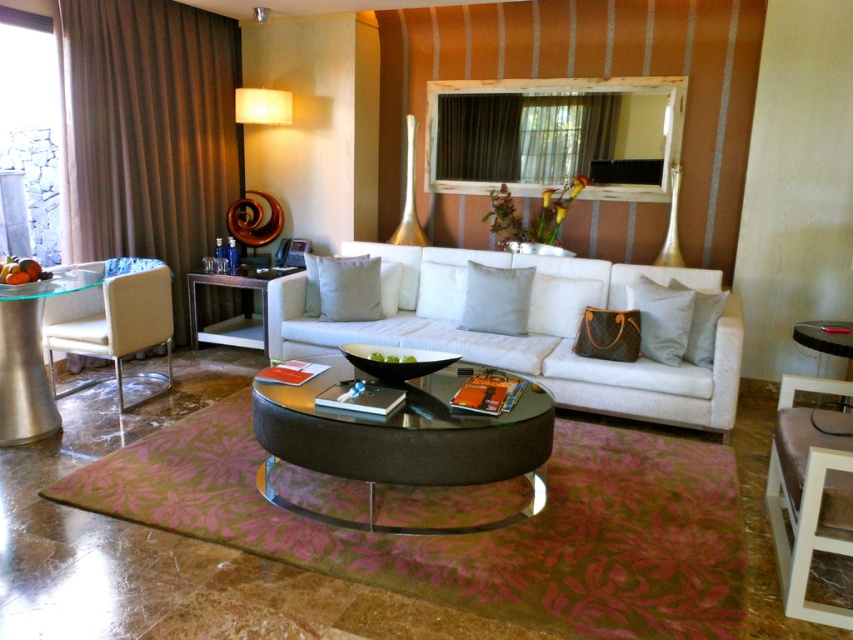
Between brown fabric curtain at left and white wood armchair at lower right, which one has more height?

With more height is brown fabric curtain at left.

In the scene shown: Which of these two, brown fabric curtain at left or white wood armchair at lower right, stands shorter?

With less height is white wood armchair at lower right.

The image size is (853, 640). I want to click on brown fabric curtain at left, so click(x=148, y=132).

Image resolution: width=853 pixels, height=640 pixels. Find the location of `brown fabric curtain at left`. brown fabric curtain at left is located at coordinates (148, 132).

Between point (39, 349) and point (711, 332), which one is positioned in front?

Point (39, 349) is more forward.

Is clear glass side table at left closer to camera compared to gray fabric pillow at center?

Yes, clear glass side table at left is closer to the viewer.

Is point (3, 305) more distant than point (712, 330)?

No.

I want to click on clear glass side table at left, so click(x=28, y=356).

Can you confirm if leather cushion at center is positioned to the right of black glass side table at right?

Incorrect, leather cushion at center is not on the right side of black glass side table at right.

Identify the location of leather cushion at center. (660, 317).